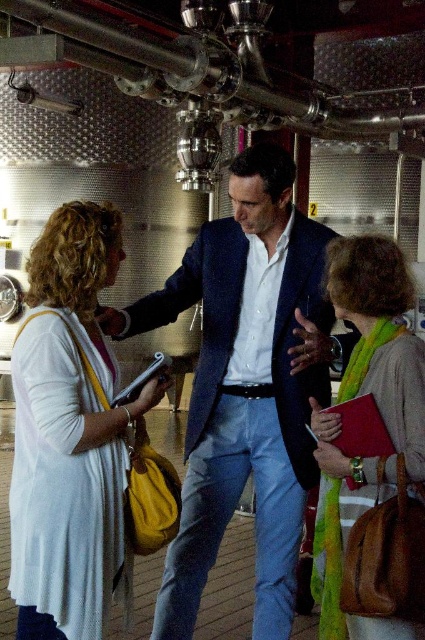
Image resolution: width=425 pixels, height=640 pixels. Describe the element at coordinates (374, 458) in the screenshot. I see `green scarf at center` at that location.

Who is more distant from viewer, (326, 570) or (325, 413)?

Positioned behind is point (326, 570).

Where is `green scarf at center`? The height and width of the screenshot is (640, 425). green scarf at center is located at coordinates (374, 458).

Is navy blue suit at center smaller than matte red notebook at center?

Actually, navy blue suit at center might be larger than matte red notebook at center.

From the picture: Who is shorter, navy blue suit at center or matte red notebook at center?

With less height is matte red notebook at center.

Who is more forward, (x=175, y=618) or (x=331, y=420)?

Point (x=331, y=420) is in front.

Locate an element on the screen. This screenshot has height=640, width=425. navy blue suit at center is located at coordinates (246, 385).

Is navy blue suit at center wider than matte yellow clipboard at center?

No, navy blue suit at center is not wider than matte yellow clipboard at center.

Does point (255, 156) lie in front of point (135, 397)?

No, (255, 156) is behind (135, 397).

Image resolution: width=425 pixels, height=640 pixels. Identify the location of navy blue suit at center. (246, 385).